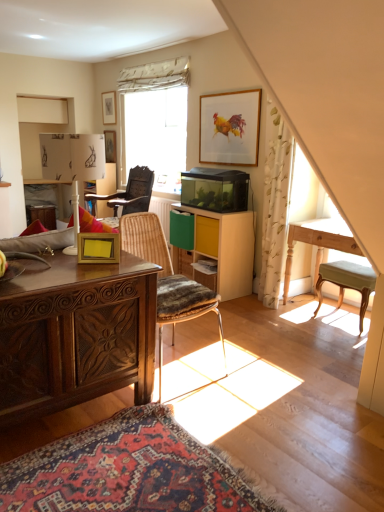
The width and height of the screenshot is (384, 512). In order to click on unoccupied region to the right of rustic wood chair at center, marked as the 1th chair in a front-to-back arrangement in this screenshot , I will do `click(258, 372)`.